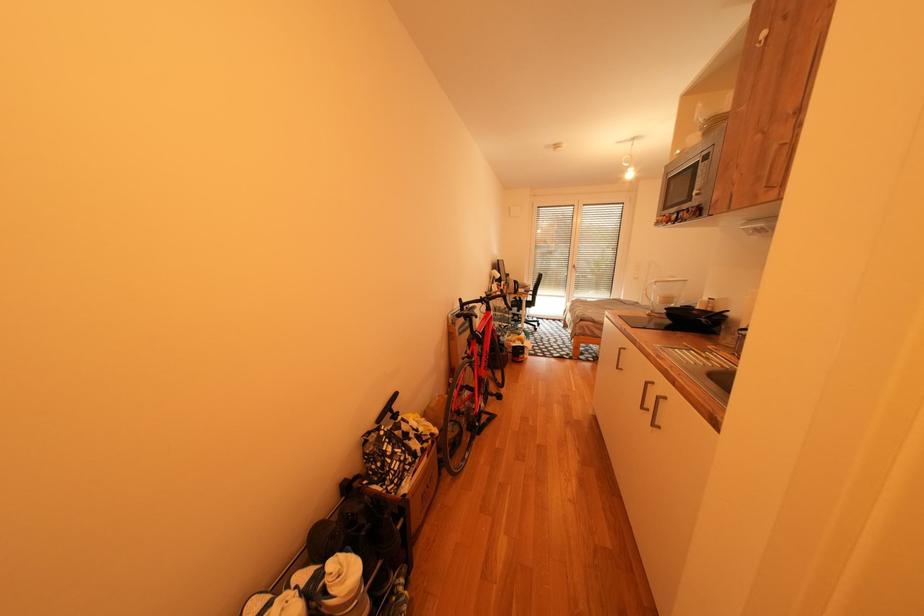
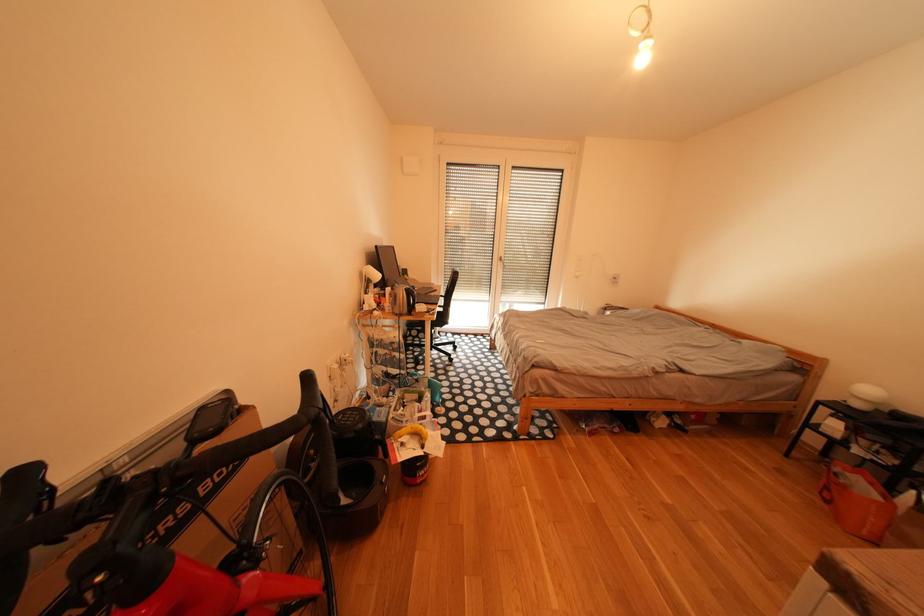
Question: What movement of the cameraman would produce the second image?

Choices:
 (A) Left
 (B) Right
 (C) Forward
 (D) Backward

Answer: (C)